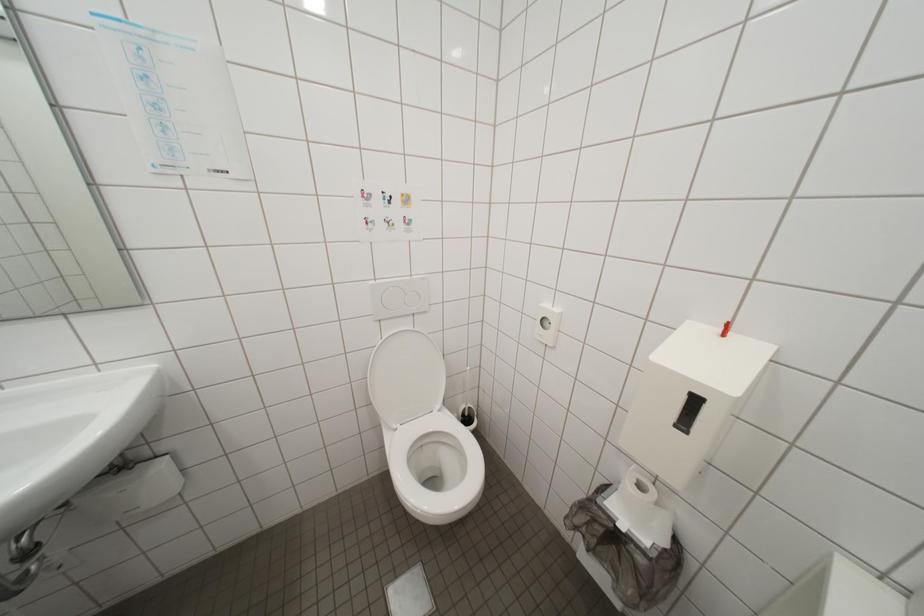
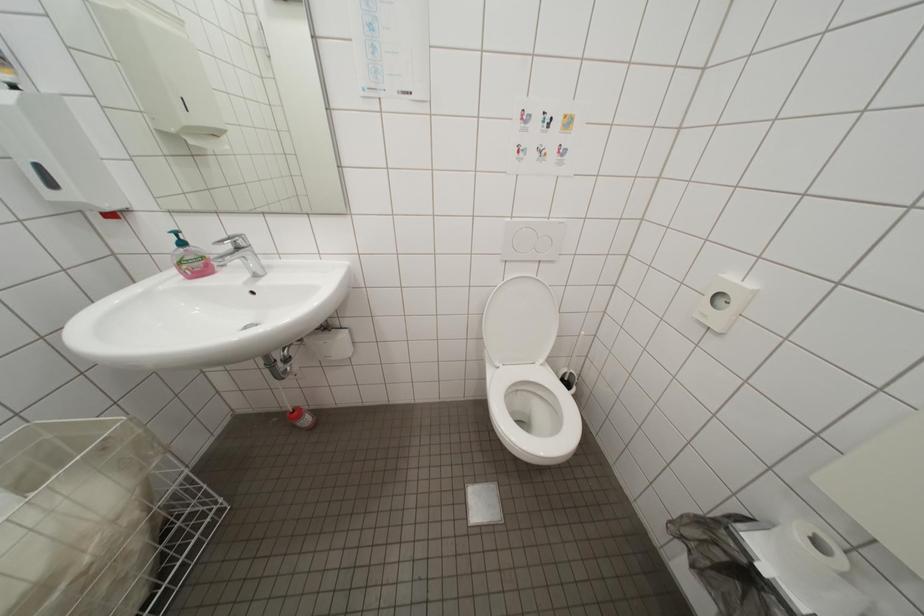
Question: How did the camera likely rotate?

Choices:
 (A) Left
 (B) Right
 (C) Up
 (D) Down

Answer: (A)